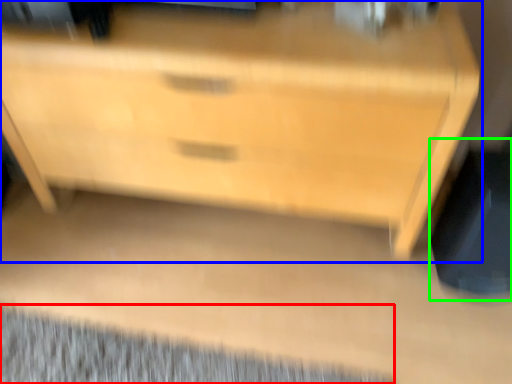
Question: Estimate the real-world distances between objects in this image. Which object is closer to mat (highlighted by a red box), chest of drawers (highlighted by a blue box) or swivel chair (highlighted by a green box)?

Choices:
 (A) chest of drawers
 (B) swivel chair

Answer: (A)